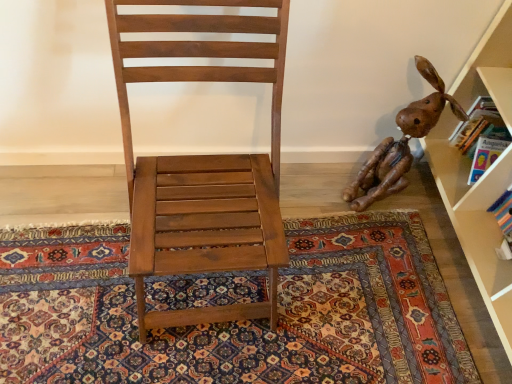
Question: Is matte wood chair at center facing towards brown leather dog at right?

Choices:
 (A) no
 (B) yes

Answer: (A)

Question: From the image's perspective, does matte wood chair at center appear lower than brown leather dog at right?

Choices:
 (A) yes
 (B) no

Answer: (A)

Question: Is matte wood chair at center placed right next to brown leather dog at right?

Choices:
 (A) no
 (B) yes

Answer: (A)

Question: From a real-world perspective, is matte wood chair at center positioned under brown leather dog at right based on gravity?

Choices:
 (A) yes
 (B) no

Answer: (B)

Question: From the image's perspective, is matte wood chair at center located above brown leather dog at right?

Choices:
 (A) no
 (B) yes

Answer: (A)

Question: From the image's perspective, is brown leather dog at right located above or below carpeted floor at center?

Choices:
 (A) above
 (B) below

Answer: (A)

Question: In terms of width, does brown leather dog at right look wider or thinner when compared to carpeted floor at center?

Choices:
 (A) thin
 (B) wide

Answer: (A)

Question: Is point coord(398,125) positioned closer to the camera than point coord(331,370)?

Choices:
 (A) closer
 (B) farther

Answer: (B)

Question: Is brown leather dog at right in front of or behind carpeted floor at center in the image?

Choices:
 (A) behind
 (B) front

Answer: (A)

Question: Is matte wood chair at center inside the boundaries of carpeted floor at center, or outside?

Choices:
 (A) inside
 (B) outside

Answer: (B)

Question: From a real-world perspective, is matte wood chair at center positioned above or below carpeted floor at center?

Choices:
 (A) below
 (B) above

Answer: (B)

Question: Based on their sizes in the image, would you say matte wood chair at center is bigger or smaller than carpeted floor at center?

Choices:
 (A) big
 (B) small

Answer: (A)

Question: Relative to carpeted floor at center, is matte wood chair at center in front or behind?

Choices:
 (A) behind
 (B) front

Answer: (B)

Question: From a real-world perspective, is carpeted floor at center positioned above or below matte wood chair at center?

Choices:
 (A) above
 (B) below

Answer: (B)

Question: Does point (391, 349) appear closer or farther from the camera than point (118, 96)?

Choices:
 (A) closer
 (B) farther

Answer: (B)